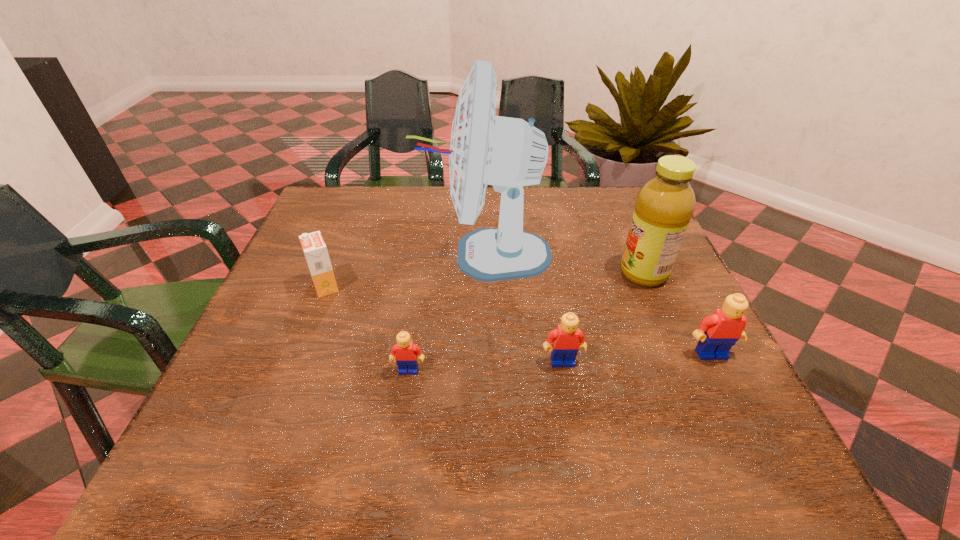
Find the location of a particular element. This screenshot has height=540, width=960. free space at the far edge of the desktop is located at coordinates (389, 190).

The width and height of the screenshot is (960, 540). Identify the location of vacant space at the near edge of the desktop. (392, 395).

At what (x,y) coordinates should I click in order to perform the action: click on free region at the left edge of the desktop. Please return your answer as a coordinate pair (x, y). Image resolution: width=960 pixels, height=540 pixels. Looking at the image, I should click on (342, 281).

Where is `free space at the right edge`? The height and width of the screenshot is (540, 960). free space at the right edge is located at coordinates (612, 242).

Identify the location of vacant space at the far left corner. (348, 207).

Locate an element on the screen. free region at the near left corner is located at coordinates (293, 400).

Identify the location of vacant region at the far right corner of the desktop. (630, 217).

What are the coordinates of `free space between the fifth shortest object and the tallest object` in the screenshot? It's located at (565, 264).

The image size is (960, 540). What are the coordinates of `empty location between the tallest Lego and the fruit juice` in the screenshot? It's located at (677, 313).

Where is `blank region between the second shortest Lego and the tallest object`? Image resolution: width=960 pixels, height=540 pixels. blank region between the second shortest Lego and the tallest object is located at coordinates (524, 308).